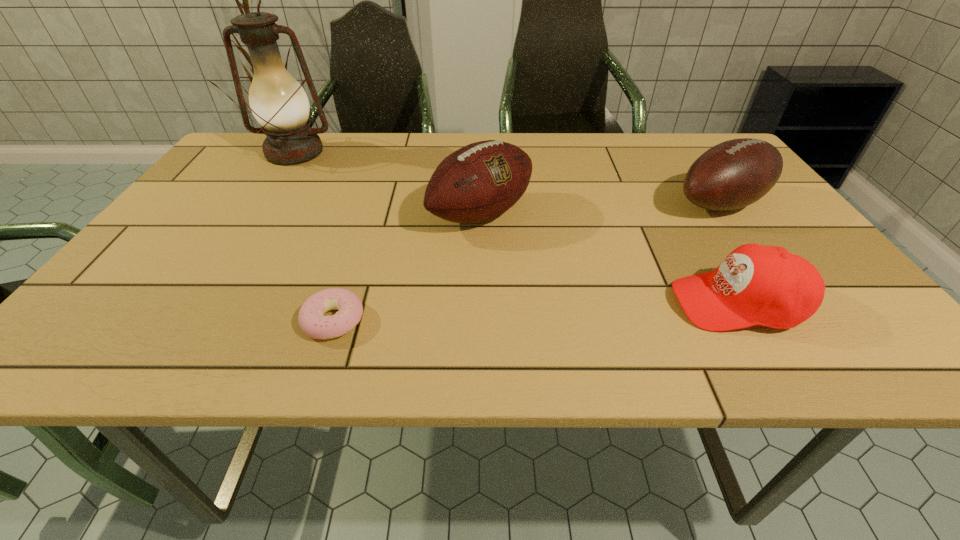
At what (x,y) coordinates should I click in order to perform the action: click on vacant region located 0.340m on the front panel of the baseball cap. Please return your answer as a coordinate pair (x, y). Looking at the image, I should click on (494, 303).

Locate an element on the screen. The width and height of the screenshot is (960, 540). free region located 0.120m on the front panel of the baseball cap is located at coordinates (610, 303).

At what (x,y) coordinates should I click in order to perform the action: click on vacant space positioned 0.250m on the front panel of the baseball cap. Please return your answer as a coordinate pair (x, y). The image size is (960, 540). Looking at the image, I should click on (541, 303).

Where is `vacant area situated 0.200m on the right of the doughnut`? This screenshot has height=540, width=960. vacant area situated 0.200m on the right of the doughnut is located at coordinates (x=473, y=320).

The height and width of the screenshot is (540, 960). Identify the location of object positioned at the far edge. (278, 102).

At what (x,y) coordinates should I click in order to perform the action: click on baseball cap that is positioned at the near edge. Please return your answer as a coordinate pair (x, y). Image resolution: width=960 pixels, height=540 pixels. Looking at the image, I should click on (762, 285).

You are a GUI agent. You are given a task and a screenshot of the screen. Output one action in this format:
    pyautogui.click(x=<x>, y=<y>)
    Task: Click on the doughnut positioned at the near edge
    
    Given the screenshot: What is the action you would take?
    pyautogui.click(x=312, y=321)

Find the location of a particular element. object that is at the left edge is located at coordinates (278, 102).

The height and width of the screenshot is (540, 960). Find the location of `football (American) situated at the right edge`. football (American) situated at the right edge is located at coordinates (736, 173).

Identify the location of baseball cap at the right edge. The width and height of the screenshot is (960, 540). (762, 285).